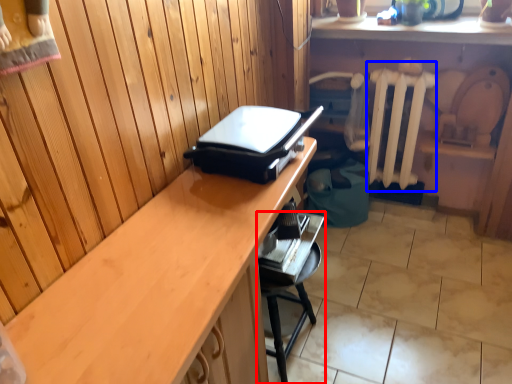
Question: Which object is closer to the camera taking this photo, furniture (highlighted by a red box) or radiator (highlighted by a blue box)?

Choices:
 (A) furniture
 (B) radiator

Answer: (A)